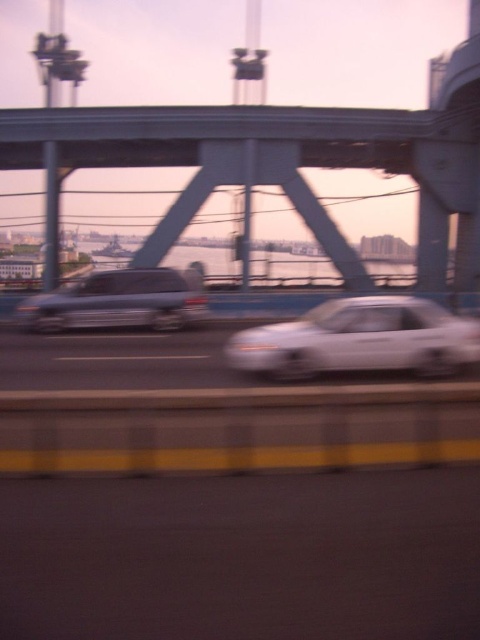
You are a delivery driver trying to park your 2.5 meter wide truck between the white glossy sedan at center and the satin silver van at center. Based on the scene, can your truck fit between them?

The white glossy sedan at center might be wider than satin silver van at center, so it is uncertain if the 2.5 meter wide truck can fit between them without knowing the exact widths of both vehicles.

What is located at the coordinates point (360, 339) in the image?

The point (360, 339) is where the white glossy sedan at center is located.